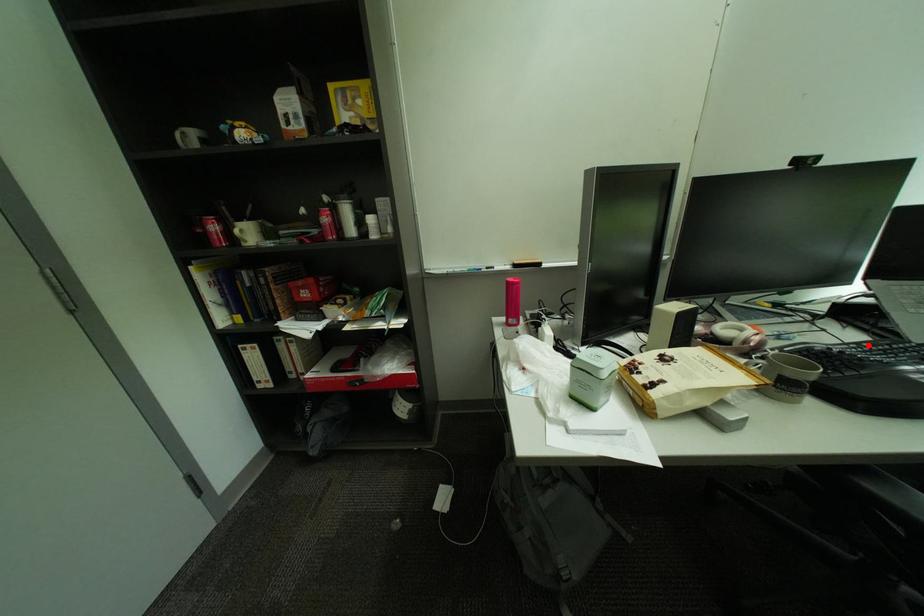
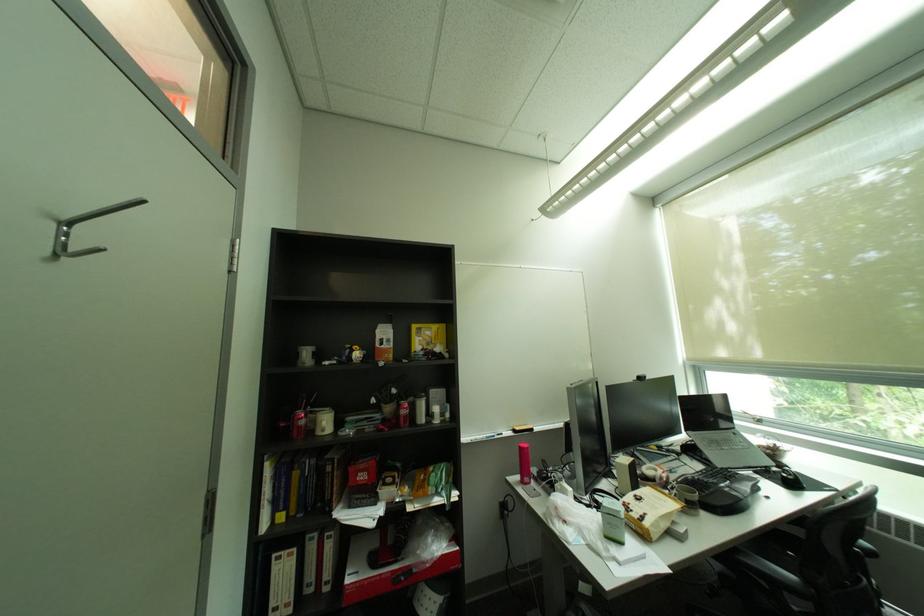
The point at the highlighted location is marked in the first image. Where is the corresponding point in the second image?

(712, 472)